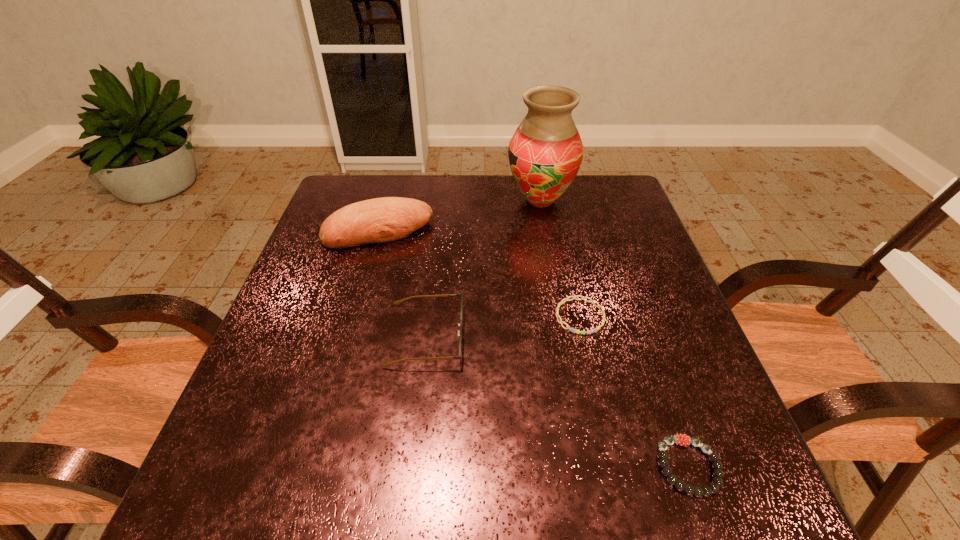
Where is `vacant space located on the surface of the left bracelet showing star-shaped elements`? The image size is (960, 540). vacant space located on the surface of the left bracelet showing star-shaped elements is located at coordinates (607, 437).

This screenshot has height=540, width=960. In order to click on vase present at the far edge in this screenshot , I will do `click(545, 153)`.

In order to click on bread that is at the far edge in this screenshot , I will do `click(386, 219)`.

Where is `object present at the near edge`? This screenshot has height=540, width=960. object present at the near edge is located at coordinates (682, 439).

This screenshot has width=960, height=540. What are the coordinates of `object located at the left edge` in the screenshot? It's located at (386, 219).

Find the location of a particular element. This screenshot has width=960, height=540. object located at the right edge is located at coordinates (682, 439).

Where is `object at the far left corner`? This screenshot has width=960, height=540. object at the far left corner is located at coordinates (386, 219).

This screenshot has width=960, height=540. In order to click on object that is positioned at the near right corner in this screenshot , I will do `click(682, 439)`.

Where is `free space at the far edge`? This screenshot has height=540, width=960. free space at the far edge is located at coordinates 506,177.

Where is `free space at the near edge of the desktop`? Image resolution: width=960 pixels, height=540 pixels. free space at the near edge of the desktop is located at coordinates (386, 510).